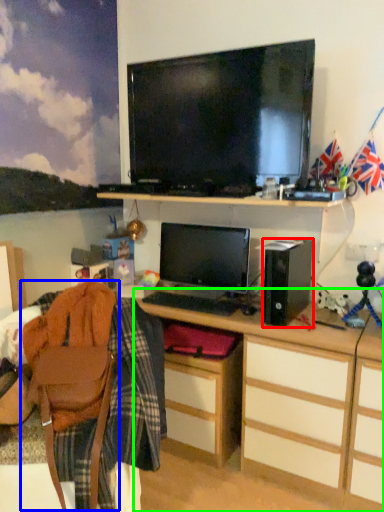
Question: Which object is positioned farthest from speaker (highlighted by a red box)? Select from swivel chair (highlighted by a blue box) and desk (highlighted by a green box).

Choices:
 (A) swivel chair
 (B) desk

Answer: (A)